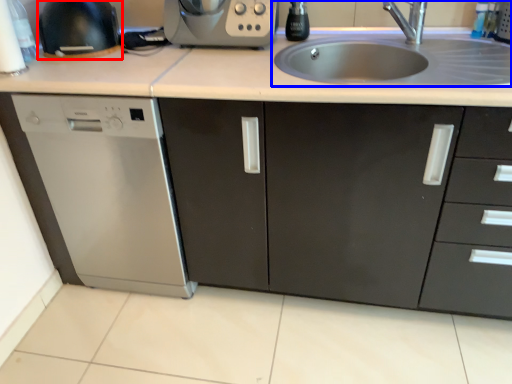
Question: Which object appears closest to the camera in this image, appliance (highlighted by a red box) or sink (highlighted by a blue box)?

Choices:
 (A) appliance
 (B) sink

Answer: (B)